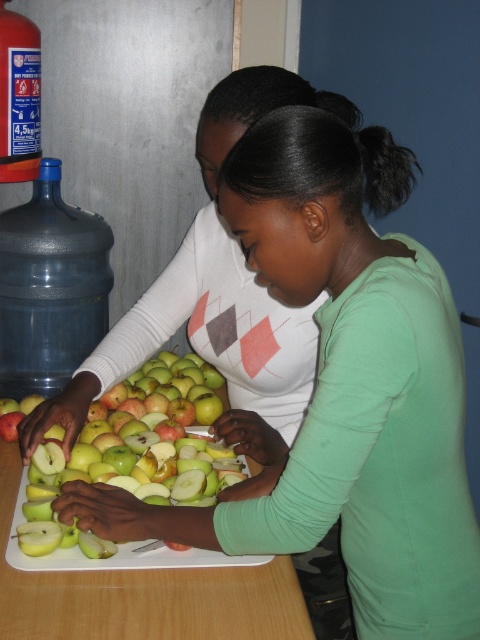
You are organizing a picnic and have two bottles, the black plastic bottle at left and the blue plastic bottle at left. You want to pack the wider one to carry more liquid. Which bottle should you choose?

The black plastic bottle at left might be wider than blue plastic bottle at left, so you should choose the black plastic bottle at left to carry more liquid.

You are organizing a fruit arrangement and need to place the green plastic tray at center and the green matte apple at center on a table. Based on their sizes, which object should you place first to ensure they both fit comfortably?

Since the green plastic tray at center is smaller than the green matte apple at center, you should place the green matte apple at center first to ensure there is enough space left for the green plastic tray at center.

You are preparing a fruit salad and need to pour water from one of the bottles. Both the black plastic bottle at left and the blue plastic bottle at left are available. Which bottle should you choose if you need to pour a larger quantity of water?

The black plastic bottle at left is larger in size than the blue plastic bottle at left, so you should choose the black plastic bottle at left to pour a larger quantity of water.